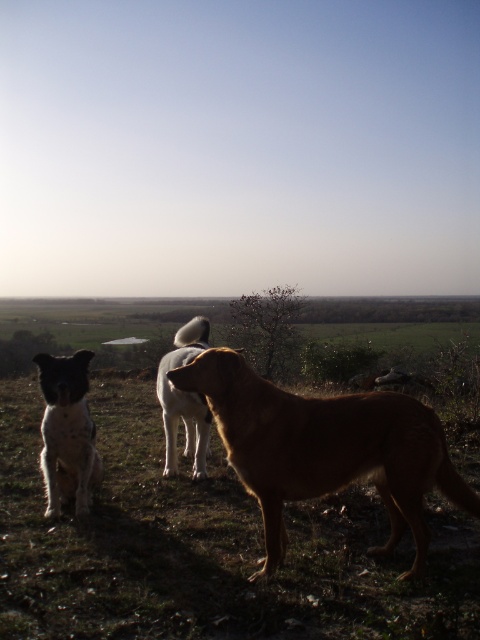
Question: Among these objects, which one is nearest to the camera?

Choices:
 (A) white fur dog at left
 (B) brown furry dog at center

Answer: (B)

Question: Is white fur dog at left to the left of white fur dog at center from the viewer's perspective?

Choices:
 (A) yes
 (B) no

Answer: (A)

Question: Based on their relative distances, which object is farther from the white fur dog at left?

Choices:
 (A) white fur dog at center
 (B) brown furry dog at center

Answer: (B)

Question: Is brown furry dog at center closer to the viewer compared to white fur dog at left?

Choices:
 (A) no
 (B) yes

Answer: (B)

Question: Is brown furry dog at center behind white fur dog at left?

Choices:
 (A) yes
 (B) no

Answer: (B)

Question: Which object is positioned closest to the brown furry dog at center?

Choices:
 (A) white fur dog at left
 (B) white fur dog at center

Answer: (A)